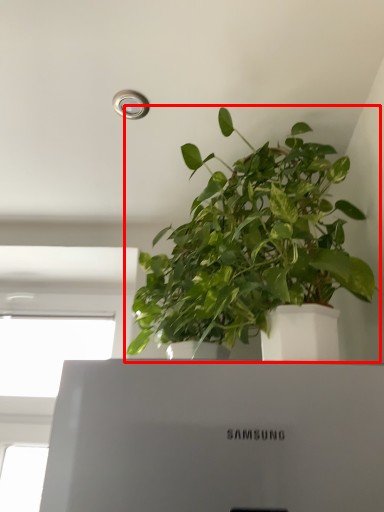
Question: Where is houseplant (annotated by the red box) located in relation to window in the image?

Choices:
 (A) left
 (B) right

Answer: (B)